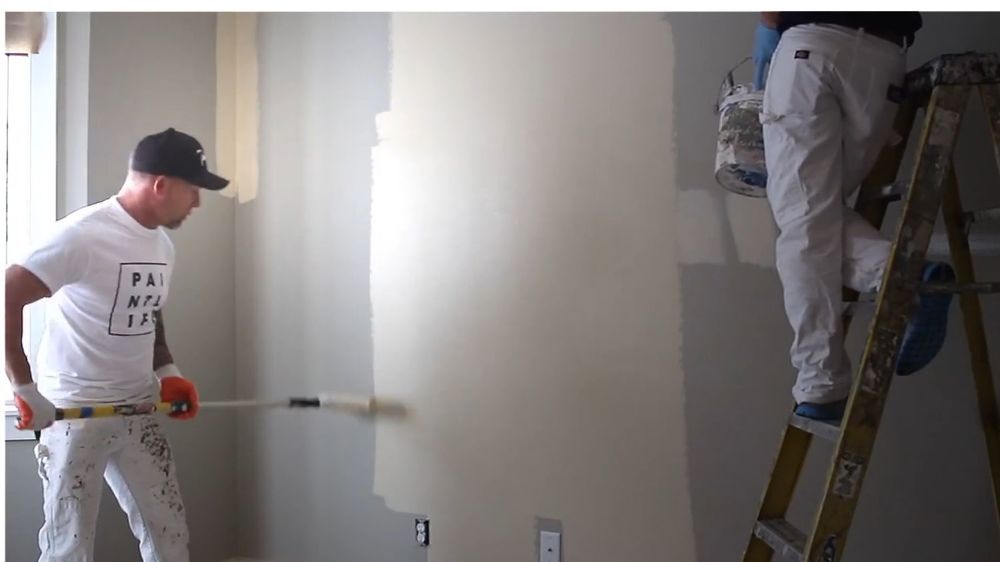
At what (x,y) coordinates should I click in order to perform the action: click on outlet. Please return your answer as a coordinate pair (x, y). Looking at the image, I should click on (418, 530).